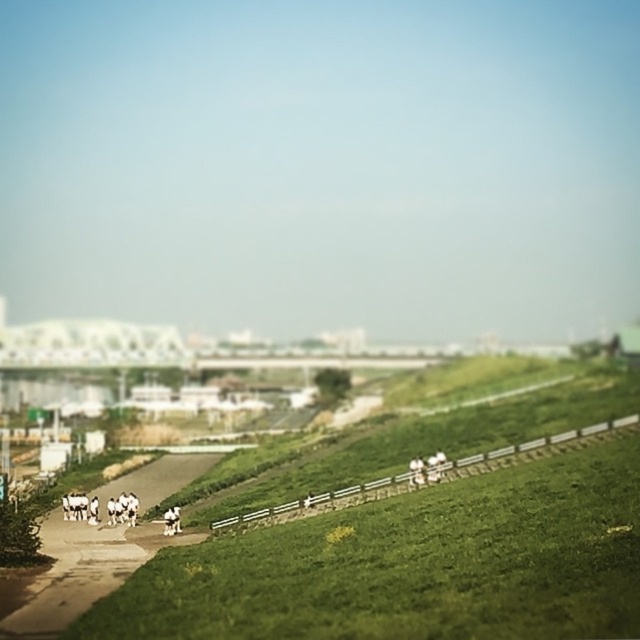
You are standing on the grassy hill and see both the white fluffy dog at lower left and the white fur horse at lower left. Which animal is closer to you?

The white fluffy dog at lower left is closer to you because the white fur horse at lower left is positioned behind it.

From the picture: You are standing at the camera position and want to take a photo of the white fluffy dog at lower left. Can you fit the dog into your camera frame if your camera has a maximum zoom range of 50 meters?

The white fluffy dog at lower left is 86.48 meters away from the camera. Since the camera can only zoom up to 50 meters, the dog will be too far to be captured clearly in the frame.

You are standing on the grassy hill and want to walk down to the pathway. You see a white fluffy dog at lower left and a white fur horse at lower left. Which animal takes up more horizontal space as you look at them from your current position?

The white fluffy dog at lower left takes up more horizontal space than the white fur horse at lower left because its width is larger.